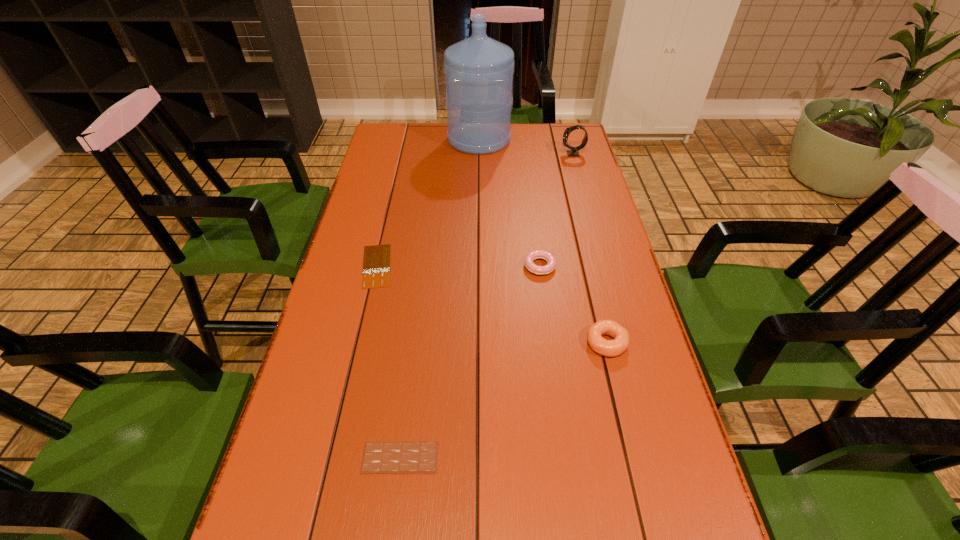
Locate an element on the screen. free region located 0.380m on the face of the second tallest object is located at coordinates (460, 154).

The height and width of the screenshot is (540, 960). Identify the location of vacant space situated 0.310m on the face of the second tallest object. (479, 154).

This screenshot has width=960, height=540. In order to click on vacant space situated 0.320m on the face of the second tallest object in this screenshot , I will do `click(476, 154)`.

Find the location of a particular element. This screenshot has width=960, height=540. free spot located 0.170m on the left of the fifth farthest object is located at coordinates coord(516,343).

Locate an element on the screen. This screenshot has height=540, width=960. vacant area situated on the front of the farther doughnut is located at coordinates (551, 354).

You are a GUI agent. You are given a task and a screenshot of the screen. Output one action in this format:
    pyautogui.click(x=<x>, y=<y>)
    Task: Click on the free space located 0.340m on the right of the nearest object
    The height and width of the screenshot is (540, 960).
    Given the screenshot: What is the action you would take?
    pyautogui.click(x=610, y=457)

You are a GUI agent. You are given a task and a screenshot of the screen. Output one action in this format:
    pyautogui.click(x=<x>, y=<y>)
    Task: Click on the vacant area located on the right of the left chocolate bar
    The image size is (960, 540).
    Given the screenshot: What is the action you would take?
    pyautogui.click(x=517, y=266)

The width and height of the screenshot is (960, 540). I want to click on water jug located at the far edge, so click(x=478, y=70).

Find the location of a particular element. watch positioned at the far edge is located at coordinates (574, 152).

The width and height of the screenshot is (960, 540). What are the coordinates of `object that is at the left edge` in the screenshot? It's located at (376, 266).